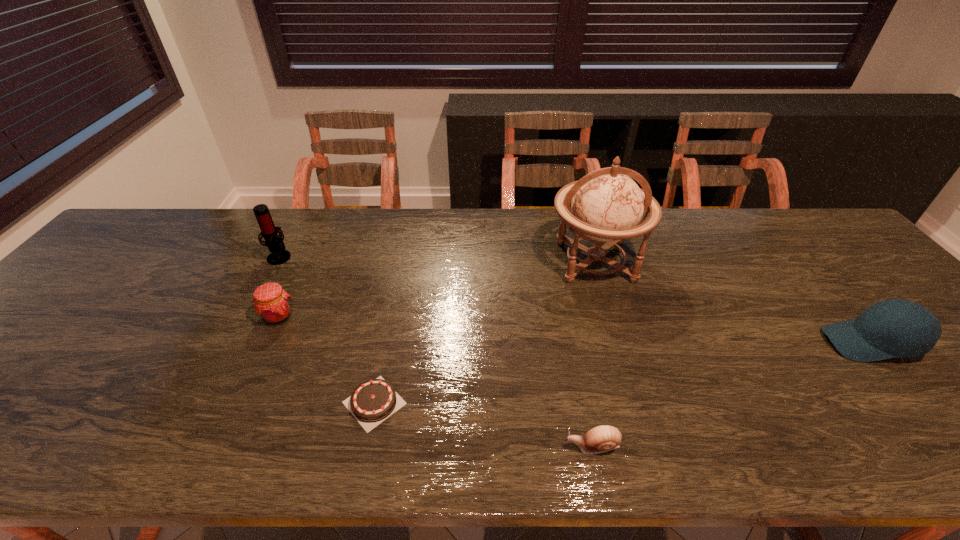
Identify the location of globe. (607, 205).

Find the location of `microphone`. microphone is located at coordinates (274, 242).

Find the location of a particular element. the second tallest object is located at coordinates (274, 242).

This screenshot has width=960, height=540. I want to click on the third tallest object, so click(x=892, y=328).

The width and height of the screenshot is (960, 540). Identify the location of the rightmost object. (892, 328).

The image size is (960, 540). What are the coordinates of `the third shortest object` in the screenshot? It's located at (272, 304).

The image size is (960, 540). In order to click on jam in this screenshot , I will do `click(272, 304)`.

The height and width of the screenshot is (540, 960). I want to click on the nearest object, so click(603, 438).

Identify the location of the fifth tallest object. This screenshot has height=540, width=960. (603, 438).

Identify the location of the fifth farthest object. This screenshot has height=540, width=960. (373, 401).